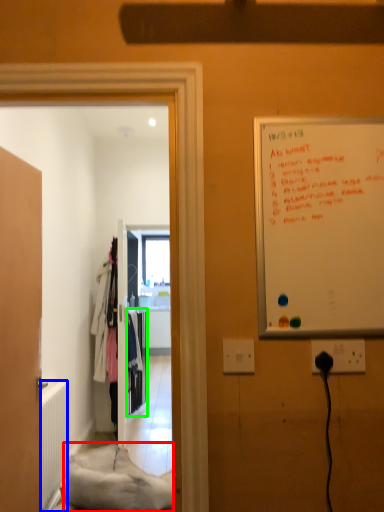
Question: Which object is positioned farthest from material (highlighted by a red box)? Select from radiator (highlighted by a blue box) and closet (highlighted by a green box).

Choices:
 (A) radiator
 (B) closet

Answer: (B)